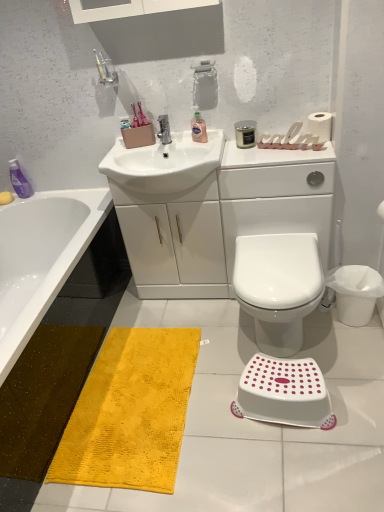
What are the coordinates of `free spot in front of white glossy toilet at center` in the screenshot? It's located at (310, 431).